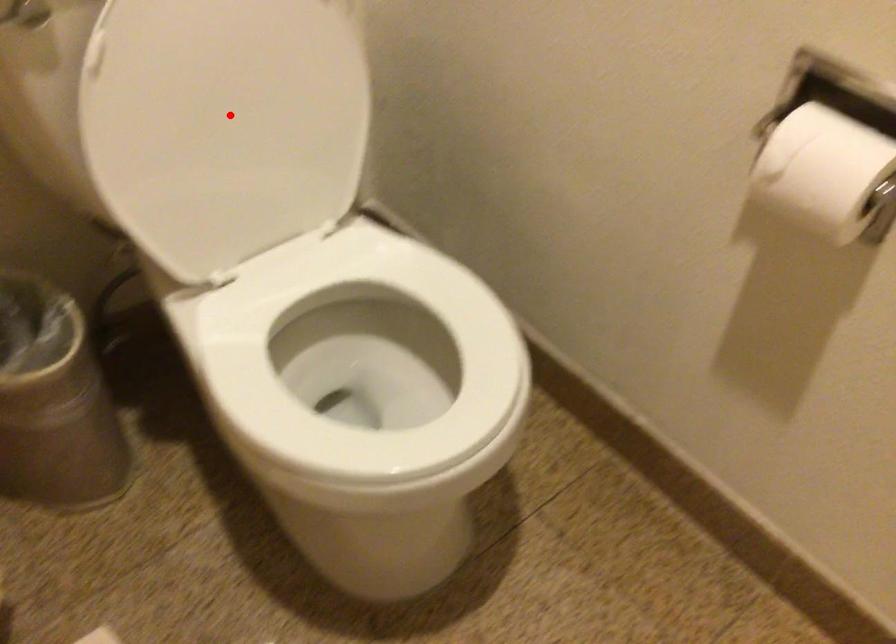
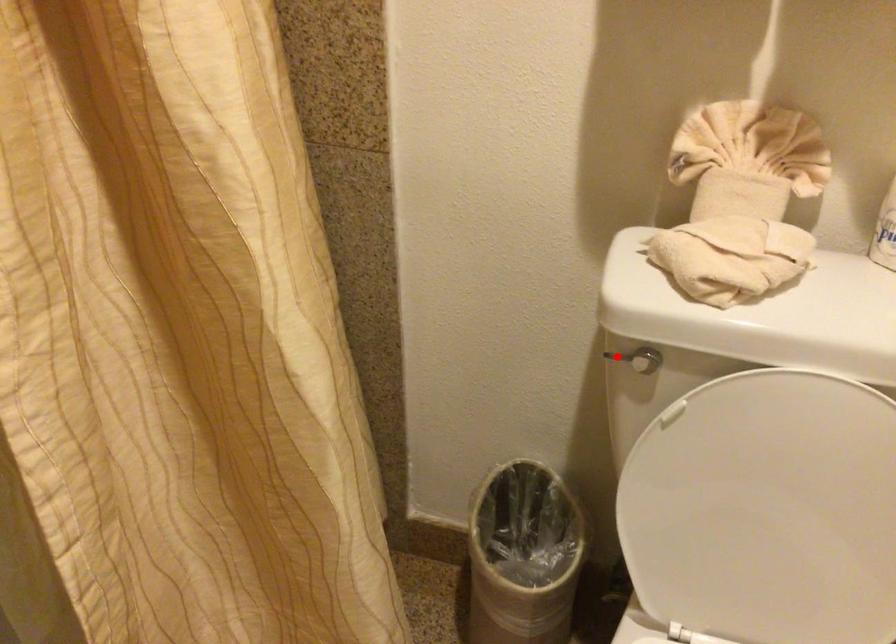
I am providing you with two images of the same scene from different viewpoints. A red point is marked on the first image and another point is marked on the second image. Are the points marked in image1 and image2 representing the same 3D position?

No